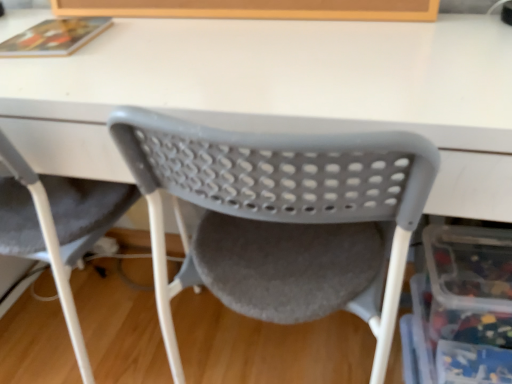
The height and width of the screenshot is (384, 512). I want to click on translucent plastic storage box at lower right, so click(461, 308).

Describe the element at coordinates (57, 225) in the screenshot. The height and width of the screenshot is (384, 512). I see `gray plastic chair at lower left, acting as the first chair starting from the left` at that location.

Image resolution: width=512 pixels, height=384 pixels. Find the location of `translucent plastic storage box at lower right`. translucent plastic storage box at lower right is located at coordinates (461, 308).

In terms of size, does matte plastic chair at center, the 2th chair positioned from the left, appear bigger or smaller than translucent plastic storage box at lower right?

In the image, matte plastic chair at center, the 2th chair positioned from the left, appears to be larger than translucent plastic storage box at lower right.

Is matte plastic chair at center, the first chair positioned from the right, turned away from translucent plastic storage box at lower right?

That's not correct — matte plastic chair at center, the first chair positioned from the right, is not looking away from translucent plastic storage box at lower right.

From the image's perspective, is matte plastic chair at center, the 2th chair positioned from the left, over translucent plastic storage box at lower right?

Yes, from the image's perspective, matte plastic chair at center, the 2th chair positioned from the left, is over translucent plastic storage box at lower right.

Is matte plastic chair at center, the first chair positioned from the right, completely or partially outside of gray plastic chair at lower left, marked as the second chair in a right-to-left arrangement?

Yes, matte plastic chair at center, the first chair positioned from the right, is located beyond the bounds of gray plastic chair at lower left, marked as the second chair in a right-to-left arrangement.

Is matte plastic chair at center, the 2th chair positioned from the left, next to gray plastic chair at lower left, marked as the second chair in a right-to-left arrangement?

They are not placed beside each other.

Is matte plastic chair at center, the first chair positioned from the right, facing towards gray plastic chair at lower left, marked as the second chair in a right-to-left arrangement?

No, matte plastic chair at center, the first chair positioned from the right, is not facing towards gray plastic chair at lower left, marked as the second chair in a right-to-left arrangement.

From the image's perspective, between matte plastic chair at center, the 2th chair positioned from the left, and gray plastic chair at lower left, marked as the second chair in a right-to-left arrangement, who is located below?

matte plastic chair at center, the 2th chair positioned from the left, from the image's perspective.

Which is more to the left, translucent plastic storage box at lower right or gray plastic chair at lower left, marked as the second chair in a right-to-left arrangement?

Positioned to the left is gray plastic chair at lower left, marked as the second chair in a right-to-left arrangement.

Looking at their sizes, would you say translucent plastic storage box at lower right is wider or thinner than gray plastic chair at lower left, acting as the first chair starting from the left?

Clearly, translucent plastic storage box at lower right has less width compared to gray plastic chair at lower left, acting as the first chair starting from the left.

Which is behind, point (469, 379) or point (108, 211)?

The point (108, 211) is behind.

Are translucent plastic storage box at lower right and gray plastic chair at lower left, marked as the second chair in a right-to-left arrangement, far apart?

No.

Considering the sizes of objects translucent plastic storage box at lower right and matte plastic chair at center, the 2th chair positioned from the left, in the image provided, who is smaller, translucent plastic storage box at lower right or matte plastic chair at center, the 2th chair positioned from the left,?

With smaller size is translucent plastic storage box at lower right.

Could you tell me if translucent plastic storage box at lower right is facing matte plastic chair at center, the first chair positioned from the right?

No, translucent plastic storage box at lower right is not aimed at matte plastic chair at center, the first chair positioned from the right.

Considering the sizes of objects translucent plastic storage box at lower right and matte plastic chair at center, the 2th chair positioned from the left, in the image provided, who is taller, translucent plastic storage box at lower right or matte plastic chair at center, the 2th chair positioned from the left,?

matte plastic chair at center, the 2th chair positioned from the left, is taller.

Locate an element on the screen. Image resolution: width=512 pixels, height=384 pixels. chair on the right of gray plastic chair at lower left, marked as the second chair in a right-to-left arrangement is located at coordinates (281, 217).

From the picture: In terms of width, does gray plastic chair at lower left, marked as the second chair in a right-to-left arrangement, look wider or thinner when compared to matte plastic chair at center, the first chair positioned from the right?

Considering their sizes, gray plastic chair at lower left, marked as the second chair in a right-to-left arrangement, looks slimmer than matte plastic chair at center, the first chair positioned from the right.

From the image's perspective, is gray plastic chair at lower left, acting as the first chair starting from the left, under matte plastic chair at center, the 2th chair positioned from the left?

No, from the image's perspective, gray plastic chair at lower left, acting as the first chair starting from the left, is not below matte plastic chair at center, the 2th chair positioned from the left.

Measure the distance from gray plastic chair at lower left, marked as the second chair in a right-to-left arrangement, to translucent plastic storage box at lower right.

gray plastic chair at lower left, marked as the second chair in a right-to-left arrangement, is 68.55 centimeters away from translucent plastic storage box at lower right.

Where is `chair that is the 2nd object located above the translucent plastic storage box at lower right (from the image's perspective)`? chair that is the 2nd object located above the translucent plastic storage box at lower right (from the image's perspective) is located at coordinates (57, 225).

Would you say gray plastic chair at lower left, marked as the second chair in a right-to-left arrangement, is outside translucent plastic storage box at lower right?

Yes.

Is gray plastic chair at lower left, marked as the second chair in a right-to-left arrangement, bigger than translucent plastic storage box at lower right?

Indeed, gray plastic chair at lower left, marked as the second chair in a right-to-left arrangement, has a larger size compared to translucent plastic storage box at lower right.

Find the location of a particular element. This screenshot has height=384, width=512. the 2nd chair directly above the translucent plastic storage box at lower right (from a real-world perspective) is located at coordinates (281, 217).

The width and height of the screenshot is (512, 384). I want to click on chair lying on the left of matte plastic chair at center, the first chair positioned from the right, so click(57, 225).

From the image, which object appears to be nearer to matte plastic chair at center, the first chair positioned from the right, translucent plastic storage box at lower right or gray plastic chair at lower left, acting as the first chair starting from the left?

Based on the image, translucent plastic storage box at lower right appears to be nearer to matte plastic chair at center, the first chair positioned from the right.

From the image, which object appears to be nearer to gray plastic chair at lower left, marked as the second chair in a right-to-left arrangement, matte plastic chair at center, the first chair positioned from the right, or translucent plastic storage box at lower right?

matte plastic chair at center, the first chair positioned from the right, is positioned closer to the anchor gray plastic chair at lower left, marked as the second chair in a right-to-left arrangement.

Considering their positions, is matte plastic chair at center, the first chair positioned from the right, positioned further to translucent plastic storage box at lower right than gray plastic chair at lower left, marked as the second chair in a right-to-left arrangement?

gray plastic chair at lower left, marked as the second chair in a right-to-left arrangement, is positioned further to the anchor translucent plastic storage box at lower right.

Based on the photo, when comparing their distances from gray plastic chair at lower left, marked as the second chair in a right-to-left arrangement, does translucent plastic storage box at lower right or matte plastic chair at center, the 2th chair positioned from the left, seem further?

translucent plastic storage box at lower right.

Based on their spatial positions, is gray plastic chair at lower left, marked as the second chair in a right-to-left arrangement, or translucent plastic storage box at lower right further from matte plastic chair at center, the first chair positioned from the right?

Among the two, gray plastic chair at lower left, marked as the second chair in a right-to-left arrangement, is located further to matte plastic chair at center, the first chair positioned from the right.

Based on their spatial positions, is gray plastic chair at lower left, acting as the first chair starting from the left, or matte plastic chair at center, the first chair positioned from the right, closer to translucent plastic storage box at lower right?

matte plastic chair at center, the first chair positioned from the right, is positioned closer to the anchor translucent plastic storage box at lower right.

Locate an element on the screen. Image resolution: width=512 pixels, height=384 pixels. chair located between gray plastic chair at lower left, acting as the first chair starting from the left, and translucent plastic storage box at lower right in the left-right direction is located at coordinates pos(281,217).